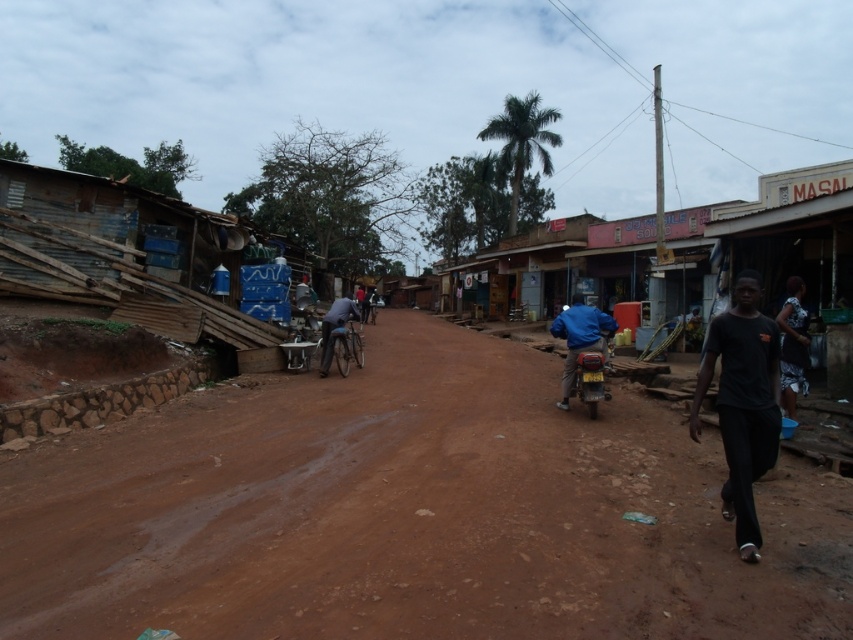
Question: Which point appears farthest from the camera in this image?

Choices:
 (A) (764, 358)
 (B) (799, 353)
 (C) (572, 374)
 (D) (347, 317)

Answer: (D)

Question: Which of these objects is positioned farthest from the blue fabric jacket on the right?

Choices:
 (A) dark gray fabric dress at lower right
 (B) matte blue motorcycle at center
 (C) brown dirt field at center

Answer: (C)

Question: Does black matte shirt at right appear under matte blue motorcycle at center?

Choices:
 (A) yes
 (B) no

Answer: (B)

Question: Which of the following is the farthest from the observer?

Choices:
 (A) dark gray fabric dress at lower right
 (B) matte blue motorcycle at center
 (C) blue fabric jacket on the right

Answer: (C)

Question: Does black matte shirt at right have a greater width compared to dark blue fabric shirt at center?

Choices:
 (A) yes
 (B) no

Answer: (B)

Question: Is dark gray fabric dress at lower right below blue fabric jacket on the right?

Choices:
 (A) no
 (B) yes

Answer: (B)